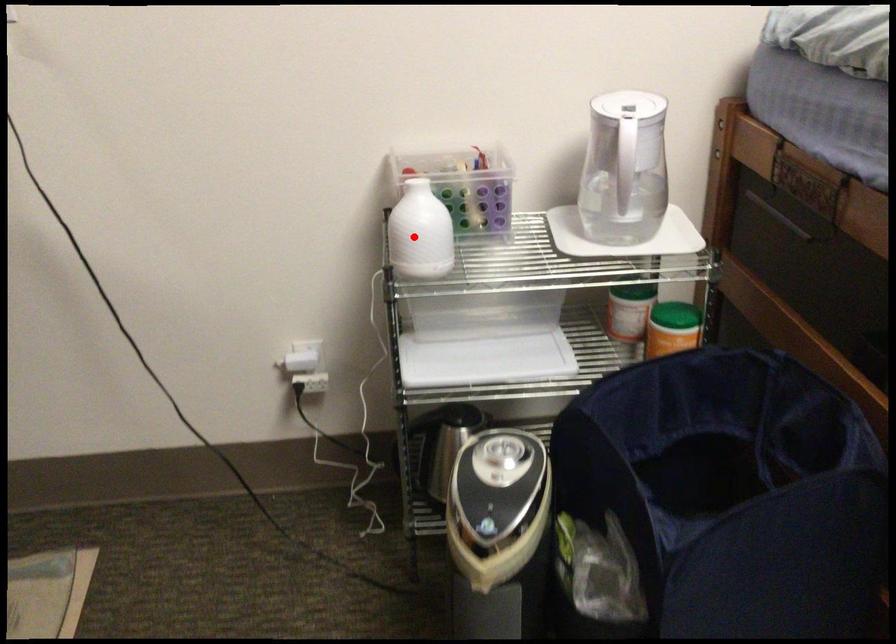
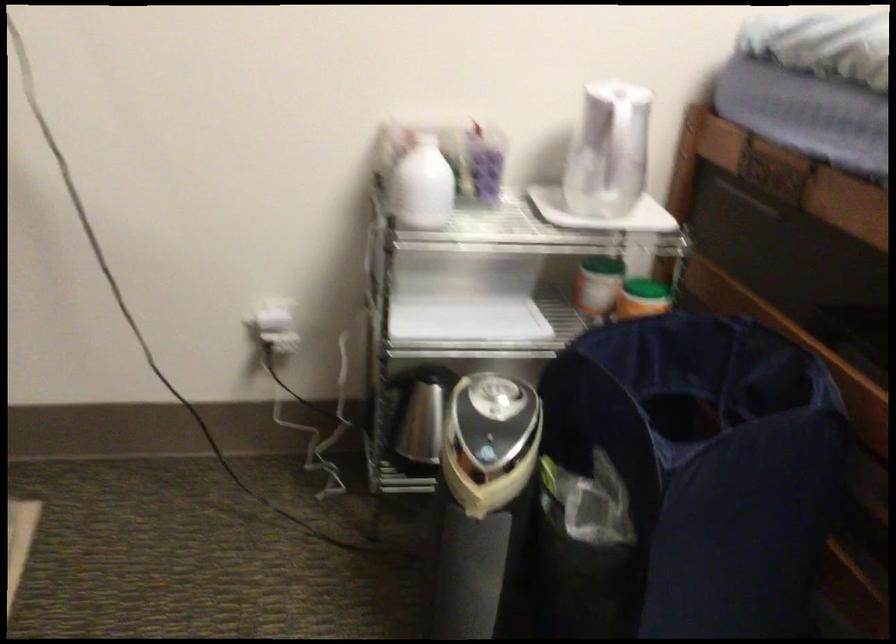
Where in the second image is the point corresponding to the highlighted location from the first image?

(421, 185)